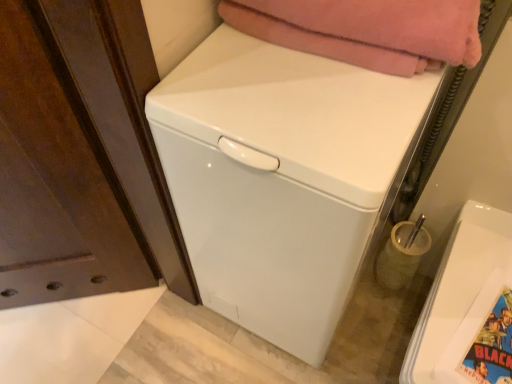
Based on the photo, in order to face colorful glossy comic book at lower right, should I rotate leftwards or rightwards?

To face it directly, rotate right by 32.279 degrees.

Describe the element at coordinates (492, 346) in the screenshot. The image size is (512, 384). I see `colorful glossy comic book at lower right` at that location.

In order to face soft pink blanket at upper center, should I rotate leftwards or rightwards?

Turn right approximately 14.101 degrees to face it.

At what (x,y) coordinates should I click in order to perform the action: click on white glossy washing machine at lower right, which is the first washing machine in right-to-left order. Please return your answer as a coordinate pair (x, y). Looking at the image, I should click on (460, 294).

Which of these two, translucent glass toothbrush holder at lower right or colorful glossy comic book at lower right, is wider?

colorful glossy comic book at lower right is wider.

Considering the sizes of objects translucent glass toothbrush holder at lower right and colorful glossy comic book at lower right in the image provided, who is smaller, translucent glass toothbrush holder at lower right or colorful glossy comic book at lower right?

colorful glossy comic book at lower right is smaller.

Would you say translucent glass toothbrush holder at lower right is outside colorful glossy comic book at lower right?

translucent glass toothbrush holder at lower right lies outside colorful glossy comic book at lower right's area.

Based on the photo, is translucent glass toothbrush holder at lower right aimed at colorful glossy comic book at lower right?

No.

Between colorful glossy comic book at lower right and soft pink blanket at upper center, which one has less height?

Standing shorter between the two is colorful glossy comic book at lower right.

Does colorful glossy comic book at lower right have a smaller size compared to soft pink blanket at upper center?

Yes.

Does point (510, 305) come closer to viewer compared to point (347, 26)?

No, it is behind (347, 26).

Considering the relative sizes of colorful glossy comic book at lower right and soft pink blanket at upper center in the image provided, is colorful glossy comic book at lower right wider than soft pink blanket at upper center?

No.

Is soft pink blanket at upper center oriented towards translucent glass toothbrush holder at lower right?

No, soft pink blanket at upper center is not aimed at translucent glass toothbrush holder at lower right.

From a real-world perspective, is soft pink blanket at upper center located beneath translucent glass toothbrush holder at lower right?

No, from a real-world perspective, soft pink blanket at upper center is not below translucent glass toothbrush holder at lower right.

Is soft pink blanket at upper center inside the boundaries of translucent glass toothbrush holder at lower right, or outside?

soft pink blanket at upper center exists outside the volume of translucent glass toothbrush holder at lower right.

Are soft pink blanket at upper center and translucent glass toothbrush holder at lower right beside each other?

No, soft pink blanket at upper center is not making contact with translucent glass toothbrush holder at lower right.

Consider the image. Which object is closer to the camera taking this photo, soft pink blanket at upper center or colorful glossy comic book at lower right?

Positioned in front is soft pink blanket at upper center.

Considering the sizes of objects soft pink blanket at upper center and colorful glossy comic book at lower right in the image provided, who is taller, soft pink blanket at upper center or colorful glossy comic book at lower right?

Standing taller between the two is soft pink blanket at upper center.

Which object is positioned more to the right, soft pink blanket at upper center or colorful glossy comic book at lower right?

colorful glossy comic book at lower right.

You are a GUI agent. You are given a task and a screenshot of the screen. Output one action in this format:
    pyautogui.click(x=<x>, y=<y>)
    Task: Click on the blanket lying on the left of colorful glossy comic book at lower right
    This screenshot has height=384, width=512.
    Given the screenshot: What is the action you would take?
    pyautogui.click(x=366, y=30)

Is white glossy washing machine at center, positioned as the 2th washing machine in right-to-left order, looking in the opposite direction of white glossy washing machine at lower right, which is the 2th washing machine from left to right?

No.

Which object is closer to the camera, white glossy washing machine at center, the first washing machine from the left, or white glossy washing machine at lower right, which is the first washing machine in right-to-left order?

white glossy washing machine at center, the first washing machine from the left, is in front.

Between white glossy washing machine at center, the first washing machine from the left, and white glossy washing machine at lower right, which is the 2th washing machine from left to right, which one appears on the right side from the viewer's perspective?

Positioned to the right is white glossy washing machine at lower right, which is the 2th washing machine from left to right.

From the image's perspective, is white glossy washing machine at center, the first washing machine from the left, positioned above or below white glossy washing machine at lower right, which is the first washing machine in right-to-left order?

From the image's perspective, white glossy washing machine at center, the first washing machine from the left, appears above white glossy washing machine at lower right, which is the first washing machine in right-to-left order.

From a real-world perspective, is colorful glossy comic book at lower right on white glossy washing machine at center, positioned as the 2th washing machine in right-to-left order?

Correct, in the physical world, colorful glossy comic book at lower right is higher than white glossy washing machine at center, positioned as the 2th washing machine in right-to-left order.

Who is taller, colorful glossy comic book at lower right or white glossy washing machine at center, positioned as the 2th washing machine in right-to-left order?

Standing taller between the two is white glossy washing machine at center, positioned as the 2th washing machine in right-to-left order.

Which object is closer to the camera, colorful glossy comic book at lower right or white glossy washing machine at center, positioned as the 2th washing machine in right-to-left order?

white glossy washing machine at center, positioned as the 2th washing machine in right-to-left order, is in front.

Does colorful glossy comic book at lower right appear on the left side of white glossy washing machine at lower right, which is the 2th washing machine from left to right?

Correct, you'll find colorful glossy comic book at lower right to the left of white glossy washing machine at lower right, which is the 2th washing machine from left to right.

Considering the positions of point (466, 359) and point (478, 314), is point (466, 359) closer or farther from the camera than point (478, 314)?

Point (466, 359) is positioned closer to the camera compared to point (478, 314).

Who is taller, colorful glossy comic book at lower right or white glossy washing machine at lower right, which is the 2th washing machine from left to right?

white glossy washing machine at lower right, which is the 2th washing machine from left to right, is taller.

From the picture: Is colorful glossy comic book at lower right aimed at white glossy washing machine at lower right, which is the 2th washing machine from left to right?

Yes, colorful glossy comic book at lower right is facing white glossy washing machine at lower right, which is the 2th washing machine from left to right.

The width and height of the screenshot is (512, 384). Find the location of `appliance above the colorful glossy comic book at lower right (from the image's perspective)`. appliance above the colorful glossy comic book at lower right (from the image's perspective) is located at coordinates tap(402, 254).

Locate an element on the screen. comic book character lying below the soft pink blanket at upper center (from the image's perspective) is located at coordinates (492, 346).

Consider the image. From the image, which object appears to be nearer to white glossy washing machine at center, positioned as the 2th washing machine in right-to-left order, soft pink blanket at upper center or translucent glass toothbrush holder at lower right?

The object closer to white glossy washing machine at center, positioned as the 2th washing machine in right-to-left order, is soft pink blanket at upper center.

Which object lies further to the anchor point white glossy washing machine at center, positioned as the 2th washing machine in right-to-left order, white glossy washing machine at lower right, which is the 2th washing machine from left to right, or colorful glossy comic book at lower right?

colorful glossy comic book at lower right lies further to white glossy washing machine at center, positioned as the 2th washing machine in right-to-left order, than the other object.

From the image, which object appears to be nearer to translucent glass toothbrush holder at lower right, soft pink blanket at upper center or white glossy washing machine at lower right, which is the 2th washing machine from left to right?

Based on the image, white glossy washing machine at lower right, which is the 2th washing machine from left to right, appears to be nearer to translucent glass toothbrush holder at lower right.

From the image, which object appears to be nearer to white glossy washing machine at center, the first washing machine from the left, colorful glossy comic book at lower right or translucent glass toothbrush holder at lower right?

Answer: Among the two, colorful glossy comic book at lower right is located nearer to white glossy washing machine at center, the first washing machine from the left.

From the image, which object appears to be farther from colorful glossy comic book at lower right, white glossy washing machine at lower right, which is the first washing machine in right-to-left order, or soft pink blanket at upper center?

soft pink blanket at upper center is further to colorful glossy comic book at lower right.

Considering their positions, is colorful glossy comic book at lower right positioned further to white glossy washing machine at center, the first washing machine from the left, than soft pink blanket at upper center?

colorful glossy comic book at lower right lies further to white glossy washing machine at center, the first washing machine from the left, than the other object.

From the image, which object appears to be nearer to translucent glass toothbrush holder at lower right, soft pink blanket at upper center or white glossy washing machine at center, the first washing machine from the left?

white glossy washing machine at center, the first washing machine from the left, is closer to translucent glass toothbrush holder at lower right.

From the image, which object appears to be nearer to white glossy washing machine at lower right, which is the first washing machine in right-to-left order, soft pink blanket at upper center or colorful glossy comic book at lower right?

Among the two, colorful glossy comic book at lower right is located nearer to white glossy washing machine at lower right, which is the first washing machine in right-to-left order.

Where is `comic book character positioned between white glossy washing machine at lower right, which is the 2th washing machine from left to right, and translucent glass toothbrush holder at lower right from near to far`? The width and height of the screenshot is (512, 384). comic book character positioned between white glossy washing machine at lower right, which is the 2th washing machine from left to right, and translucent glass toothbrush holder at lower right from near to far is located at coordinates (492, 346).

You are a GUI agent. You are given a task and a screenshot of the screen. Output one action in this format:
    pyautogui.click(x=<x>, y=<y>)
    Task: Click on the comic book character between white glossy washing machine at center, positioned as the 2th washing machine in right-to-left order, and translucent glass toothbrush holder at lower right in the front-back direction
    The width and height of the screenshot is (512, 384).
    Given the screenshot: What is the action you would take?
    pyautogui.click(x=492, y=346)

Where is `washing machine that lies between soft pink blanket at upper center and white glossy washing machine at lower right, which is the first washing machine in right-to-left order, from top to bottom`? The width and height of the screenshot is (512, 384). washing machine that lies between soft pink blanket at upper center and white glossy washing machine at lower right, which is the first washing machine in right-to-left order, from top to bottom is located at coordinates (280, 177).

At what (x,y) coordinates should I click in order to perform the action: click on comic book character between soft pink blanket at upper center and white glossy washing machine at lower right, which is the first washing machine in right-to-left order, from top to bottom. Please return your answer as a coordinate pair (x, y). The width and height of the screenshot is (512, 384). Looking at the image, I should click on (492, 346).